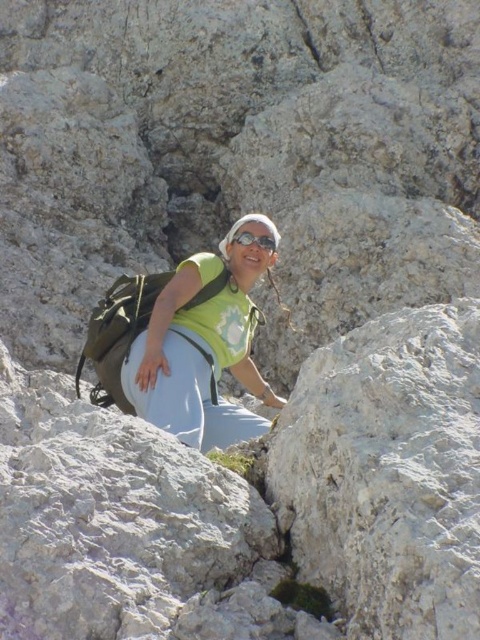
Is green matte shirt at center bigger than transparent plastic goggles at center?

Indeed, green matte shirt at center has a larger size compared to transparent plastic goggles at center.

Is green matte shirt at center to the right of transparent plastic goggles at center from the viewer's perspective?

In fact, green matte shirt at center is to the left of transparent plastic goggles at center.

What do you see at coordinates (203, 346) in the screenshot? The image size is (480, 640). I see `green matte shirt at center` at bounding box center [203, 346].

Identify the location of green matte shirt at center. (203, 346).